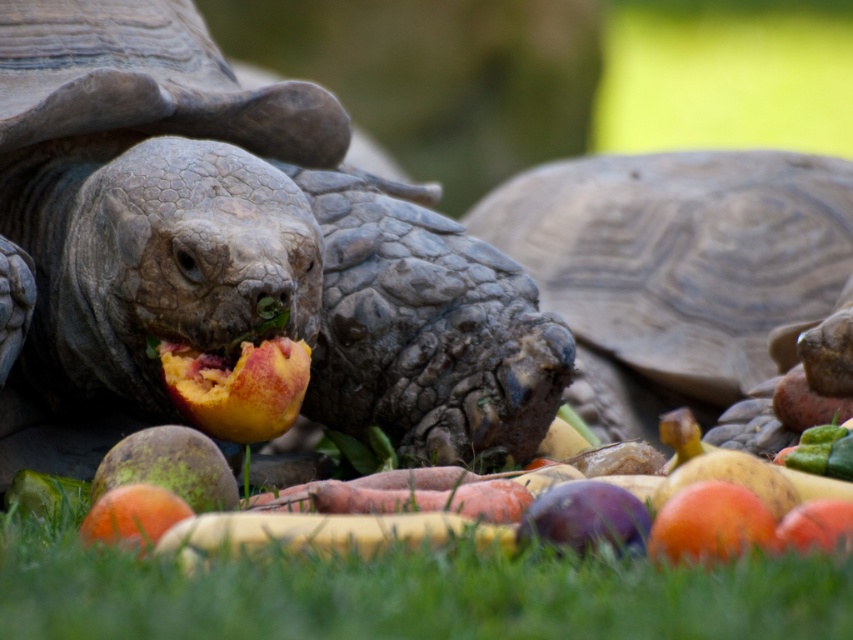
Is point (704, 369) positioned after point (164, 362)?

Yes, point (704, 369) is behind point (164, 362).

Between leathery brown tortoise at center and ripe peach at center, which one is positioned lower?

ripe peach at center is below.

Does point (718, 156) come behind point (286, 420)?

Yes.

Identify the location of leathery brown tortoise at center. This screenshot has height=640, width=853. (674, 268).

Is smooth orange mango at center to the right of orange matte peach at center from the viewer's perspective?

Indeed, smooth orange mango at center is positioned on the right side of orange matte peach at center.

Who is shorter, smooth orange mango at center or orange matte peach at center?

With less height is orange matte peach at center.

Locate an element on the screen. The image size is (853, 640). smooth orange mango at center is located at coordinates (711, 524).

Is point (809, 164) in front of point (593, 573)?

No, it is behind (593, 573).

Where is `leathery brown tortoise at center`? The image size is (853, 640). leathery brown tortoise at center is located at coordinates (674, 268).